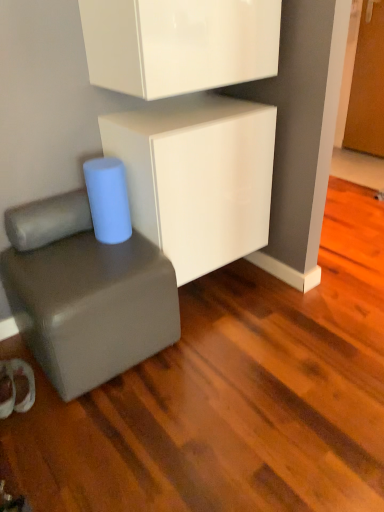
Find the location of a particular element. vacant area located to the right-hand side of matte gray cube at lower left is located at coordinates (225, 354).